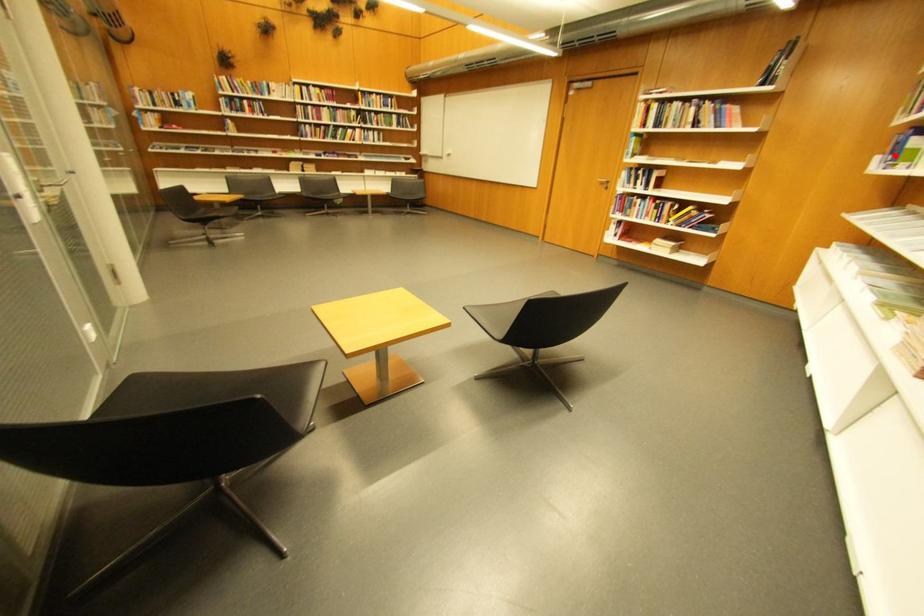
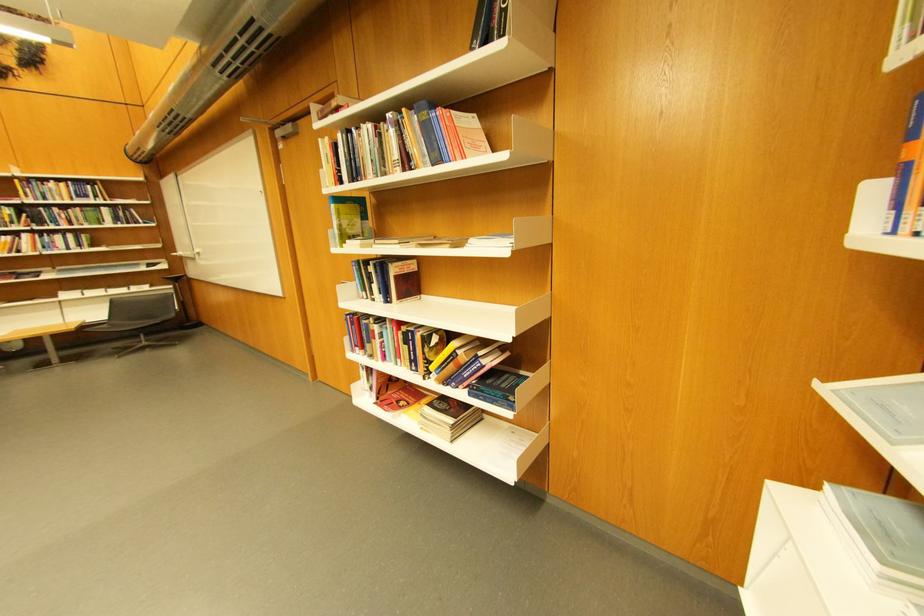
Where in the second image is the point corresponding to the highlighted location from the first image?

(913, 172)